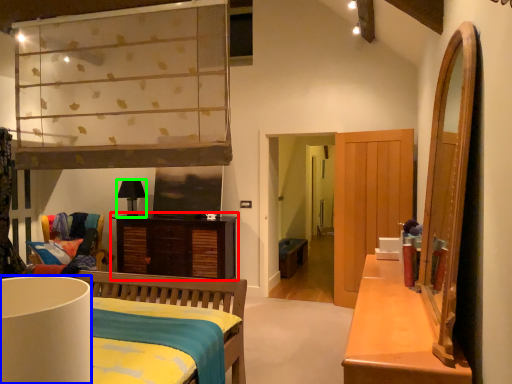
Question: Which is farther away from cabinetry (highlighted by a red box)? lamp (highlighted by a blue box) or lamp (highlighted by a green box)?

Choices:
 (A) lamp
 (B) lamp

Answer: (A)